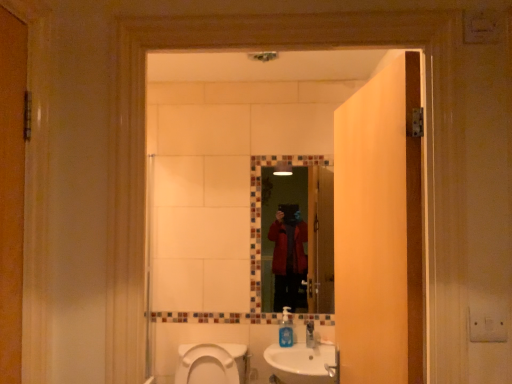
Question: From the image's perspective, is glass mosaic mirror at center above or below blue translucent soap dispenser at lower center?

Choices:
 (A) below
 (B) above

Answer: (B)

Question: Does point (274, 256) appear closer or farther from the camera than point (284, 326)?

Choices:
 (A) farther
 (B) closer

Answer: (A)

Question: Which of these objects is positioned closest to the white ceramic sink at lower center?

Choices:
 (A) blue translucent soap dispenser at lower center
 (B) wooden door at center
 (C) white glossy toilet at lower center
 (D) glass mosaic mirror at center

Answer: (A)

Question: Which object is positioned closest to the glass mosaic mirror at center?

Choices:
 (A) white glossy toilet at lower center
 (B) white ceramic sink at lower center
 (C) blue translucent soap dispenser at lower center
 (D) wooden door at center

Answer: (C)